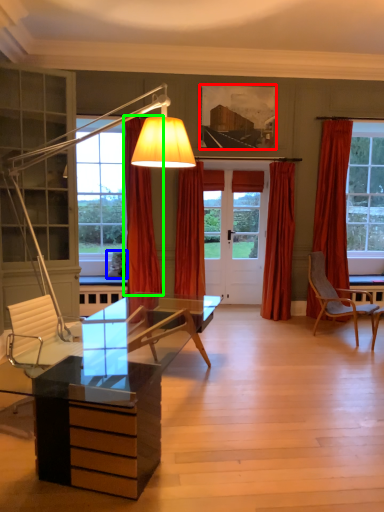
Question: Considering the real-world distances, which object is closest to picture frame (highlighted by a red box)? pillow (highlighted by a blue box) or curtain (highlighted by a green box).

Choices:
 (A) pillow
 (B) curtain

Answer: (B)